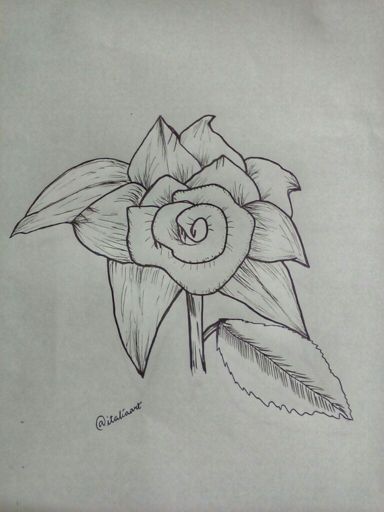
The image size is (384, 512). In order to click on right pedastals in this screenshot , I will do `click(268, 200)`.